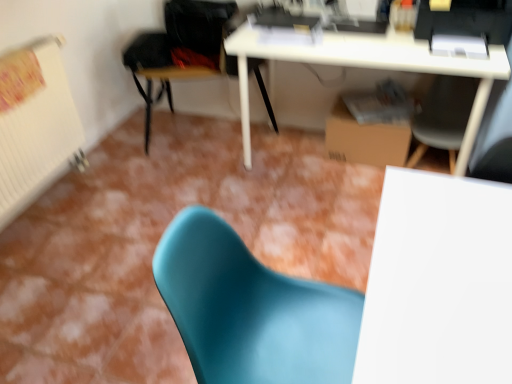
Locate an element on the screen. Image resolution: width=512 pixels, height=384 pixels. free space to the left of white glossy desk at upper center is located at coordinates (204, 194).